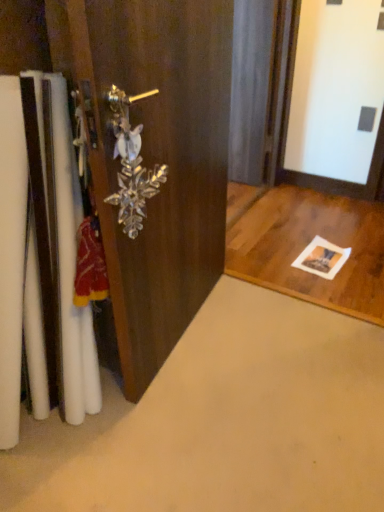
The image size is (384, 512). Find the location of `free space in front of wooden door handle at left`. free space in front of wooden door handle at left is located at coordinates (190, 425).